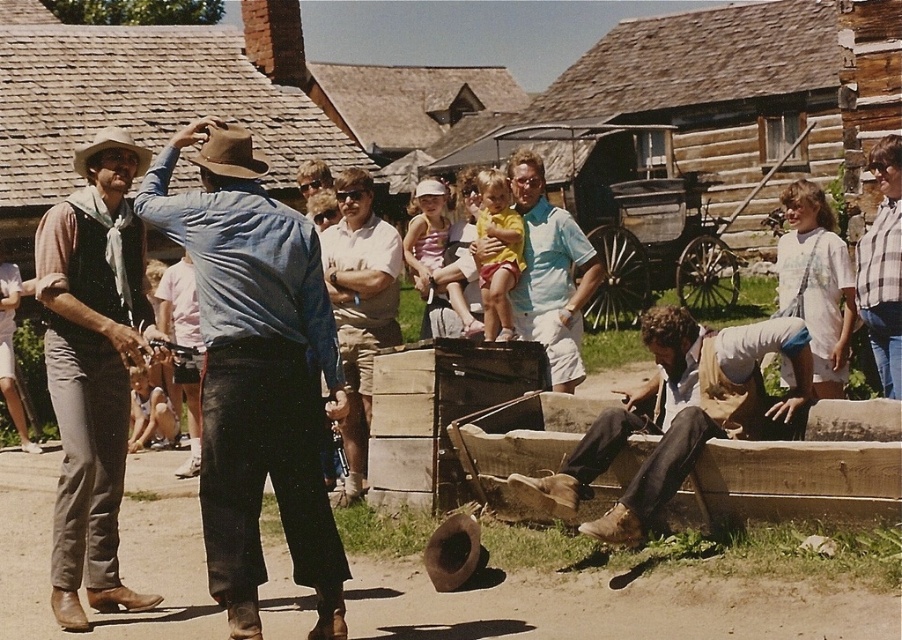
Question: Can you confirm if brown leather cowboy hat at upper center is positioned to the left of brown felt cowboy hat at upper left?

Choices:
 (A) no
 (B) yes

Answer: (A)

Question: Which point is farther to the camera?

Choices:
 (A) (114, 433)
 (B) (342, 342)

Answer: (B)

Question: Estimate the real-world distances between objects in this image. Which object is closer to the wooden wagon at center?

Choices:
 (A) denim shirt at center
 (B) brown leather boots at lower center
 (C) brown felt cowboy hat at upper left
 (D) light brown leather boots at center

Answer: (C)

Question: Does wooden wagon at center come behind brown leather cowboy hat at upper center?

Choices:
 (A) yes
 (B) no

Answer: (A)

Question: Which object appears closest to the camera in this image?

Choices:
 (A) light brown leather boots at center
 (B) rustic brown vest at center
 (C) brown leather boots at lower center
 (D) brown felt cowboy hat at upper left

Answer: (C)

Question: Does denim shirt at center come in front of light blue cotton shirt at center?

Choices:
 (A) no
 (B) yes

Answer: (B)